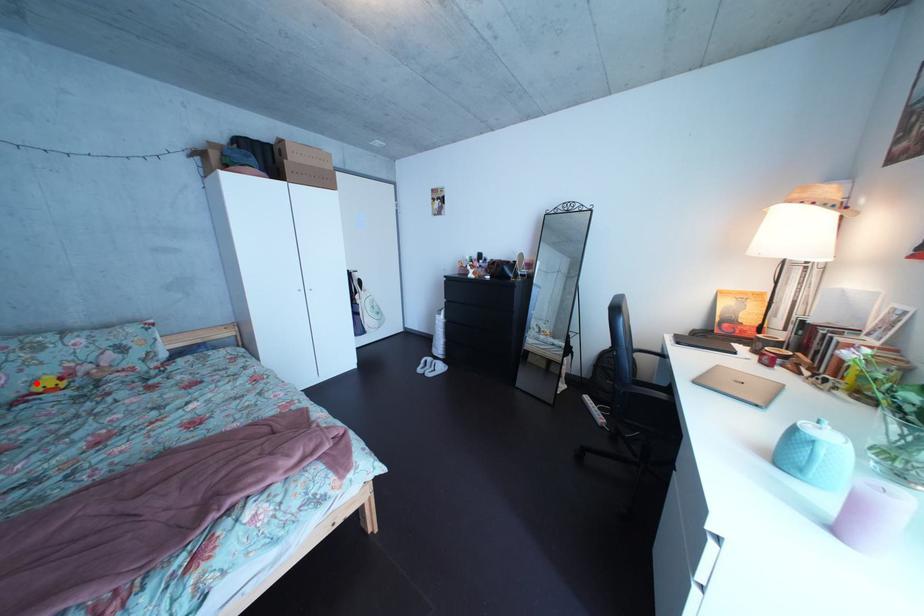
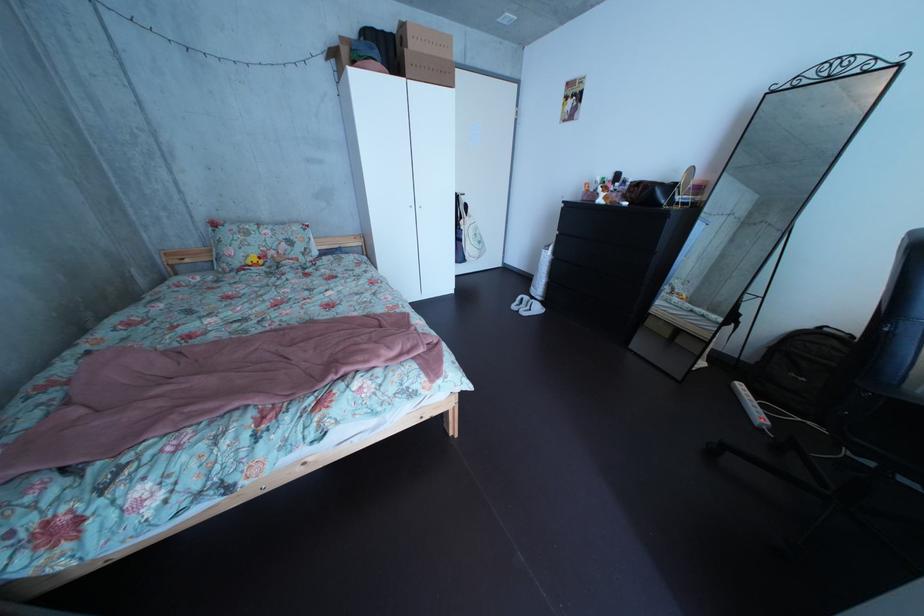
Find the pixel in the second image that matches the highlighted location in the first image.

(256, 260)